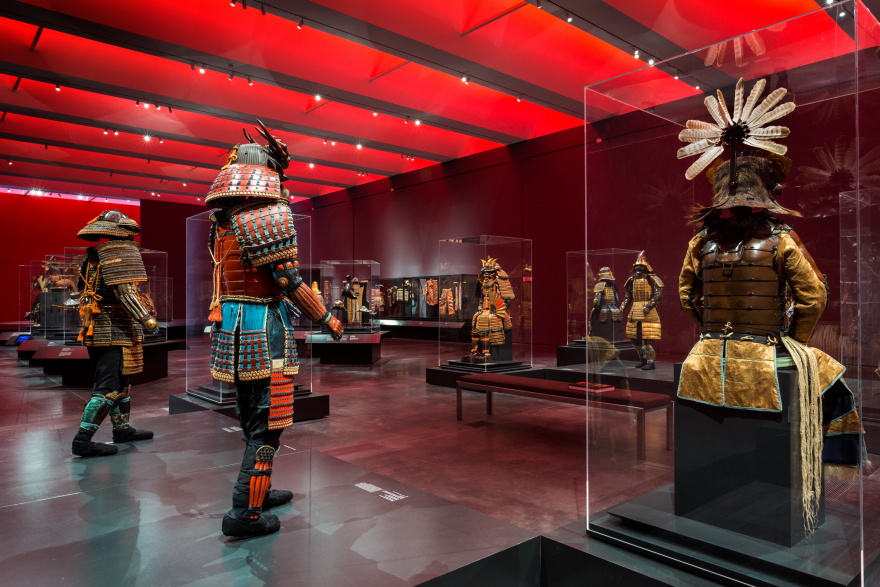
Locate an element on the screen. Image resolution: width=880 pixels, height=587 pixels. statue is located at coordinates (270, 286), (127, 305).